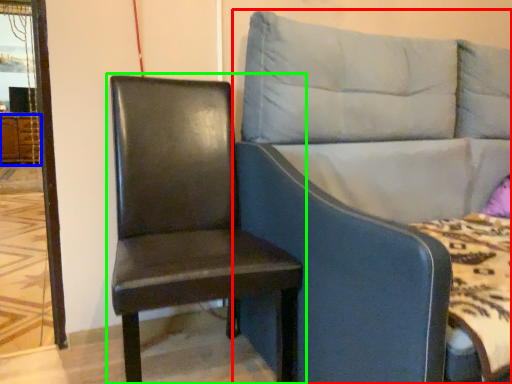
Question: Considering the real-world distances, which object is closest to studio couch (highlighted by a red box)? dresser (highlighted by a blue box) or chair (highlighted by a green box).

Choices:
 (A) dresser
 (B) chair

Answer: (B)